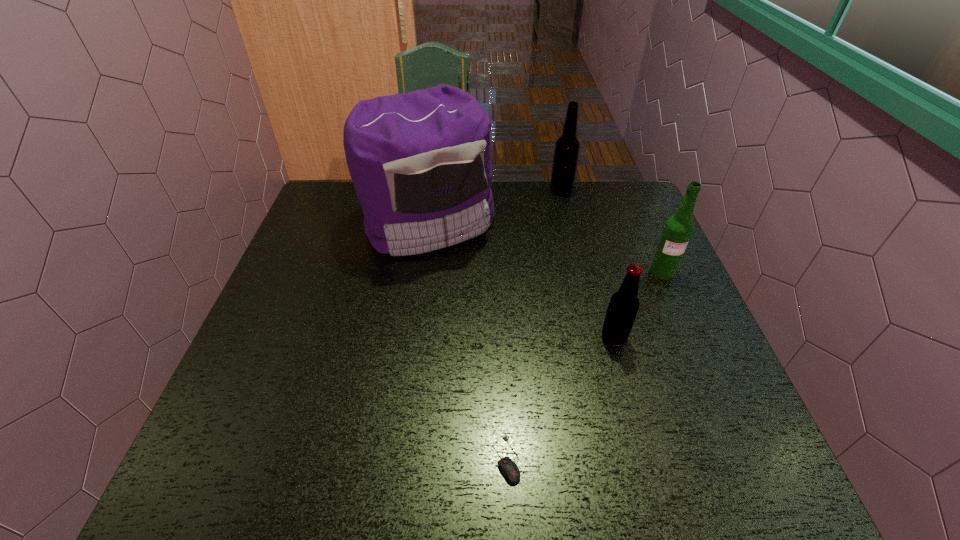
Identify the location of vacant space situated on the label of the rightmost object. The width and height of the screenshot is (960, 540). (704, 368).

Identify the location of free space located 0.320m on the back of the shortest beer bottle. The height and width of the screenshot is (540, 960). (588, 240).

The height and width of the screenshot is (540, 960). What are the coordinates of `free space located 0.140m on the right of the nearest object` in the screenshot? It's located at (598, 459).

Locate an element on the screen. This screenshot has height=540, width=960. backpack located in the far edge section of the desktop is located at coordinates (420, 162).

This screenshot has width=960, height=540. In order to click on beer bottle that is positioned at the far edge in this screenshot , I will do `click(566, 152)`.

At what (x,y) coordinates should I click in order to perform the action: click on object present at the near edge. Please return your answer as a coordinate pair (x, y). Image resolution: width=960 pixels, height=540 pixels. Looking at the image, I should click on (510, 470).

Image resolution: width=960 pixels, height=540 pixels. I want to click on object situated at the right edge, so click(678, 229).

Identify the location of vacant space at the far edge of the desktop. 502,192.

You are a GUI agent. You are given a task and a screenshot of the screen. Output one action in this format:
    pyautogui.click(x=<x>, y=<y>)
    Task: Click on the free space at the near edge
    
    Given the screenshot: What is the action you would take?
    pyautogui.click(x=371, y=453)

In the image, there is a desktop. Where is `free space at the left edge`? Image resolution: width=960 pixels, height=540 pixels. free space at the left edge is located at coordinates (269, 435).